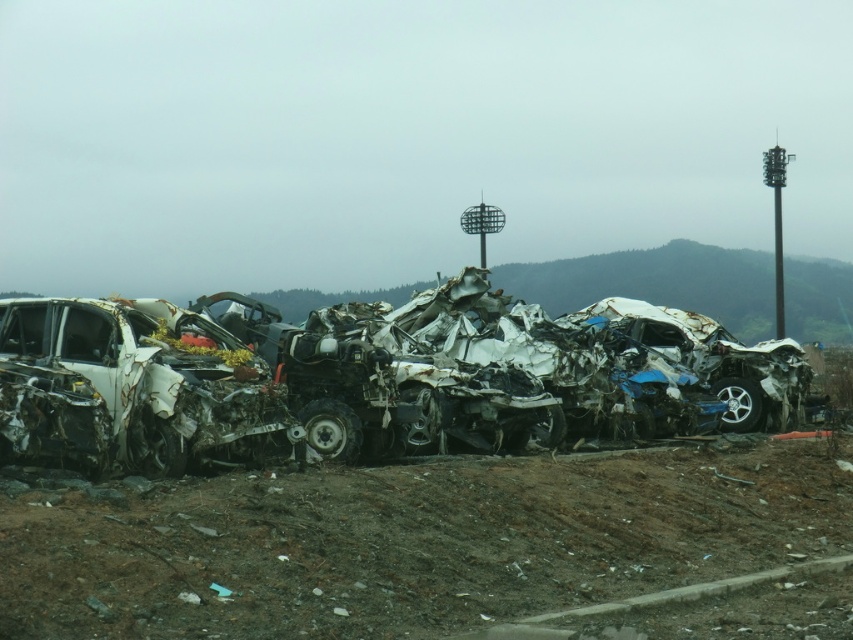
You are a scrap metal collector assessing the scene. You need to determine which vehicle takes up more horizontal space. Based on the image, which object is wider between the rusty metal wreck at center and the rusty metal car at left?

The rusty metal wreck at center is wider than the rusty metal car at left, as its width surpasses that of the latter.

You are a salvage worker trying to locate the rusty metal wreck at center. According to the coordinates provided, where exactly should you look in the scene?

The rusty metal wreck at center is located at point (521, 365).

You are a salvage worker needing to move a 6.5 feet long crane arm to the space between the rusty metal wreck at center and the rusty metal car at left. Based on the scene description, will the crane arm fit in that space?

The distance between the rusty metal wreck at center and the rusty metal car at left is 6.68 feet, which is slightly longer than the 6.5 feet length of the crane arm. Therefore, the crane arm should fit in that space.